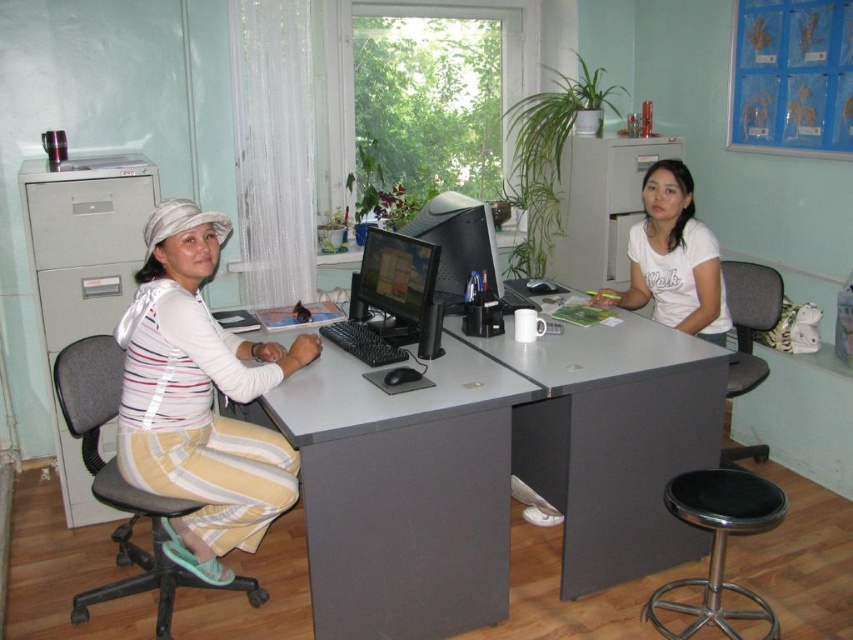
Question: Which is farther from the white matte shirt at center?

Choices:
 (A) gray matte computer desk at center
 (B) black leather stool at lower right

Answer: (B)

Question: Does black fabric swivel chair at left have a lesser width compared to white matte shirt at center?

Choices:
 (A) no
 (B) yes

Answer: (A)

Question: Which point appears farthest from the camera in this image?

Choices:
 (A) (650, 602)
 (B) (683, 253)

Answer: (B)

Question: Does gray matte computer desk at center have a greater width compared to black fabric swivel chair at right?

Choices:
 (A) yes
 (B) no

Answer: (A)

Question: Where is gray metallic file cabinet at left located in relation to black leather stool at lower right in the image?

Choices:
 (A) left
 (B) right

Answer: (A)

Question: Which object appears closest to the camera in this image?

Choices:
 (A) black fabric swivel chair at left
 (B) gray metallic file cabinet at left

Answer: (A)